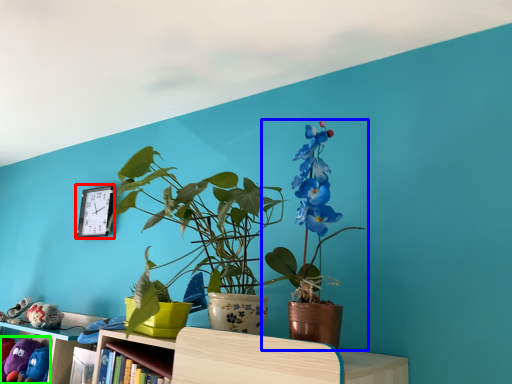
Question: Which object is the farthest from clock (highlighted by a red box)? Choose among these: houseplant (highlighted by a blue box) or toy (highlighted by a green box).

Choices:
 (A) houseplant
 (B) toy

Answer: (A)